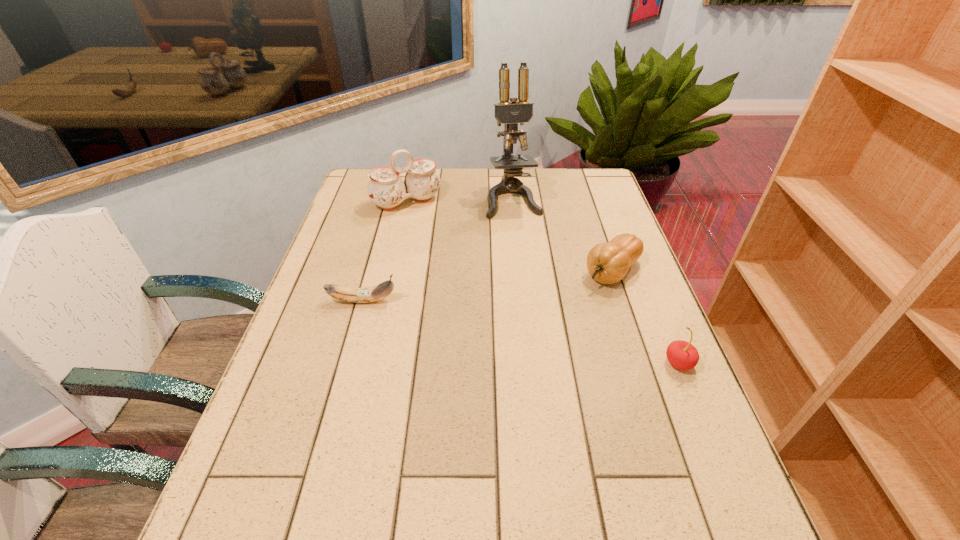
The image size is (960, 540). Identify the location of vacant space on the desktop that is between the second nearest object and the nearest object and is positioned at the eyepieces of the third object from right to left. (554, 339).

Identify the location of vacant spot on the desktop that is between the fourth farthest object and the nearest object and is positioned by the handle of the fourth shortest object. (488, 325).

Find the location of a particular element. The width and height of the screenshot is (960, 540). free spot on the desktop that is between the banana and the nearest object and is positioned on the stem side of the gourd is located at coordinates (541, 336).